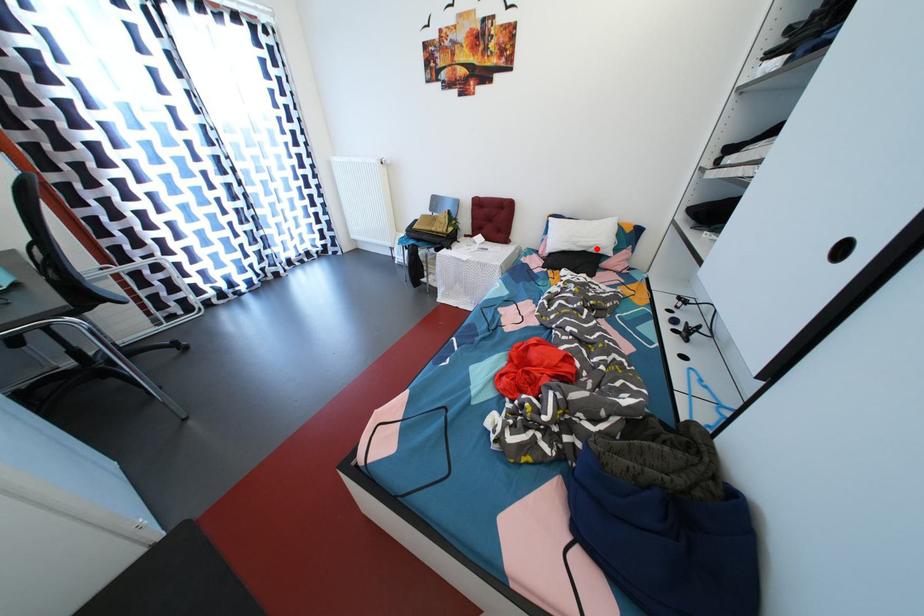
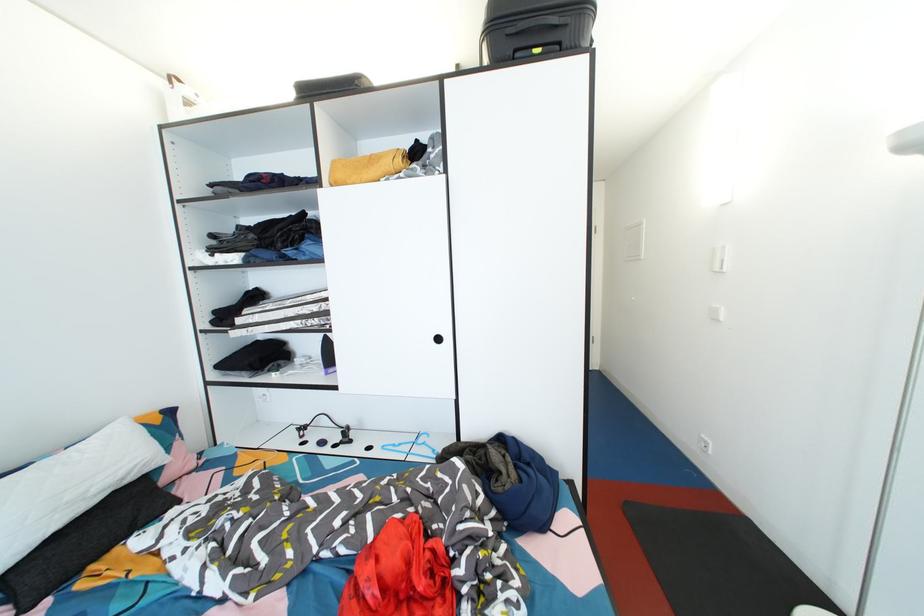
Question: I am providing you with two images of the same scene from different viewpoints. In image1, a red point is highlighted. Considering the same 3D point in image2, which of the following is correct?

Choices:
 (A) It is closer
 (B) It is farther

Answer: (B)